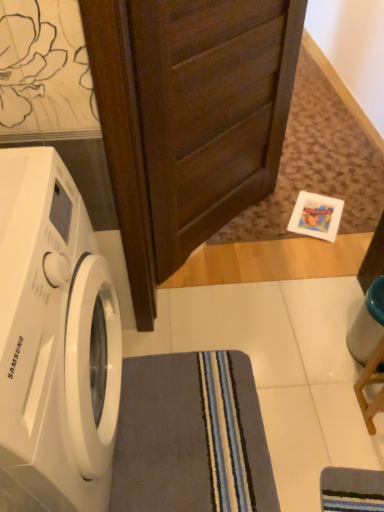
Question: Is dark wood screen door at upper center taller or shorter than gray soft rug at lower center?

Choices:
 (A) tall
 (B) short

Answer: (A)

Question: From the image's perspective, is dark wood screen door at upper center above or below gray soft rug at lower center?

Choices:
 (A) above
 (B) below

Answer: (A)

Question: Based on their relative distances, which object is nearer to the gray soft rug at lower center?

Choices:
 (A) dark wood screen door at upper center
 (B) white glossy washing machine at left

Answer: (B)

Question: Considering the real-world distances, which object is closest to the dark wood screen door at upper center?

Choices:
 (A) white glossy washing machine at left
 (B) gray soft rug at lower center

Answer: (A)